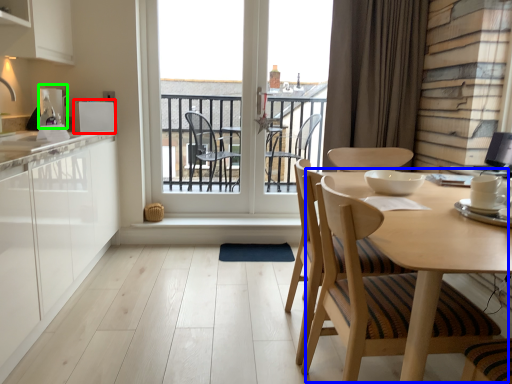
Question: Estimate the real-world distances between objects in this image. Which object is closer to appliance (highlighted by a red box), round table (highlighted by a blue box) or appliance (highlighted by a green box)?

Choices:
 (A) round table
 (B) appliance

Answer: (B)